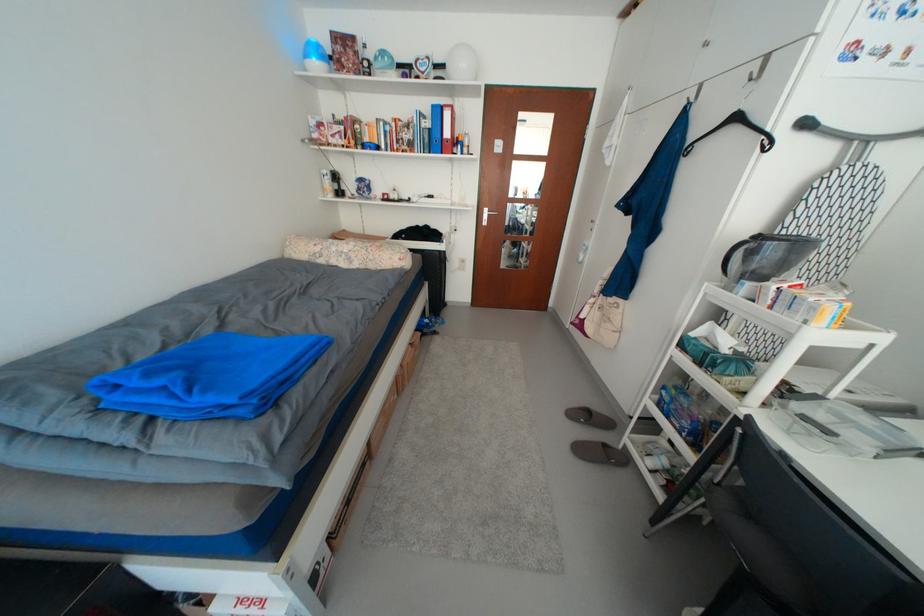
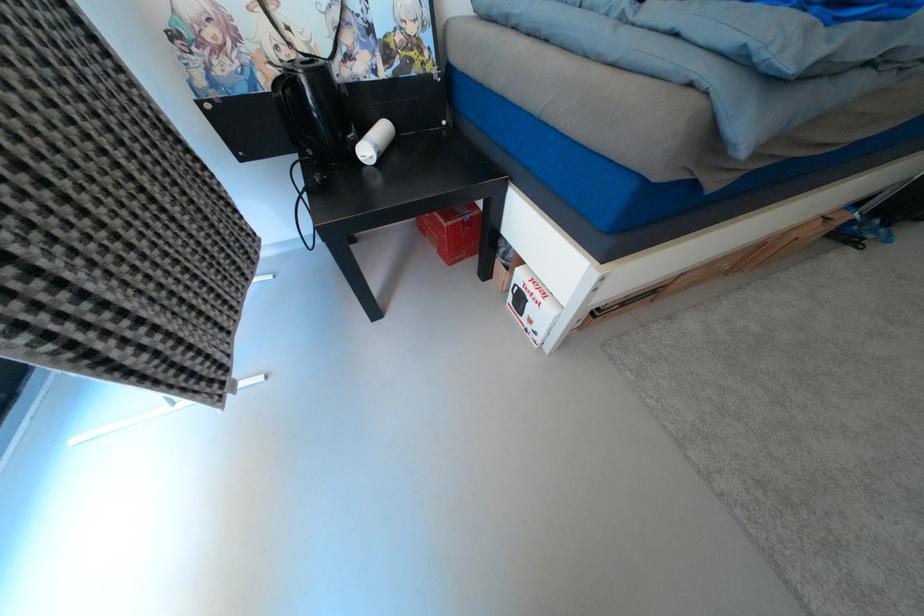
Based on the continuous images, in which direction is the camera rotating?

The camera rotated toward left-down.